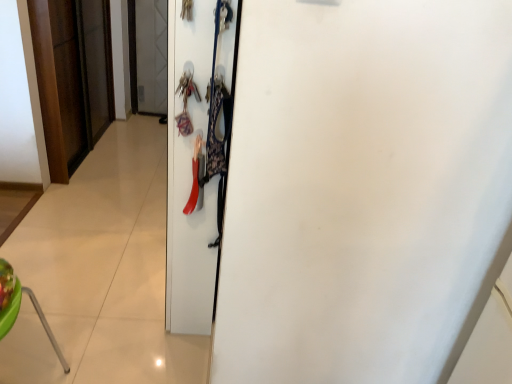
Find the location of a particular element. The image size is (512, 384). vacant space in wooden door at left, which ranks as the second door in front-to-back order (from a real-world perspective) is located at coordinates (88, 155).